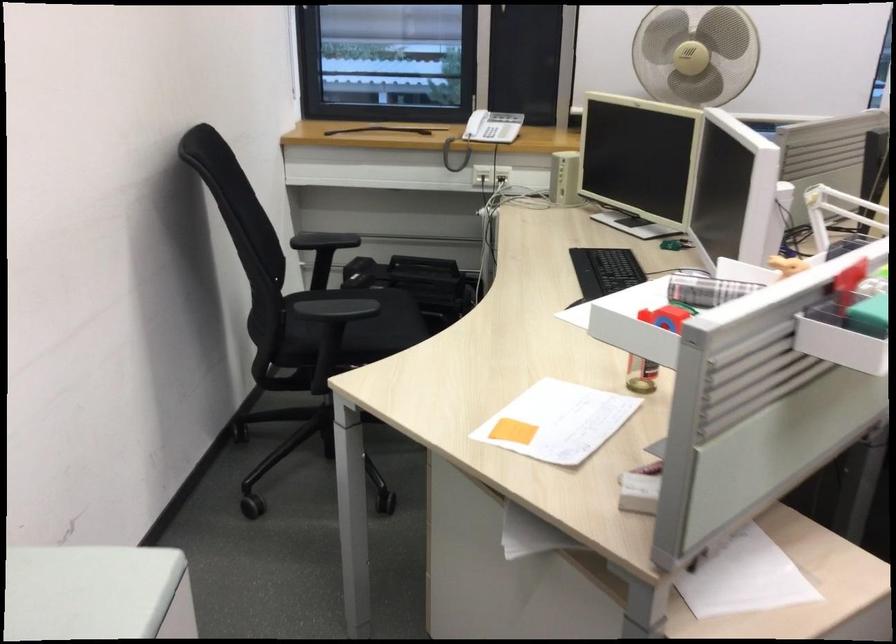
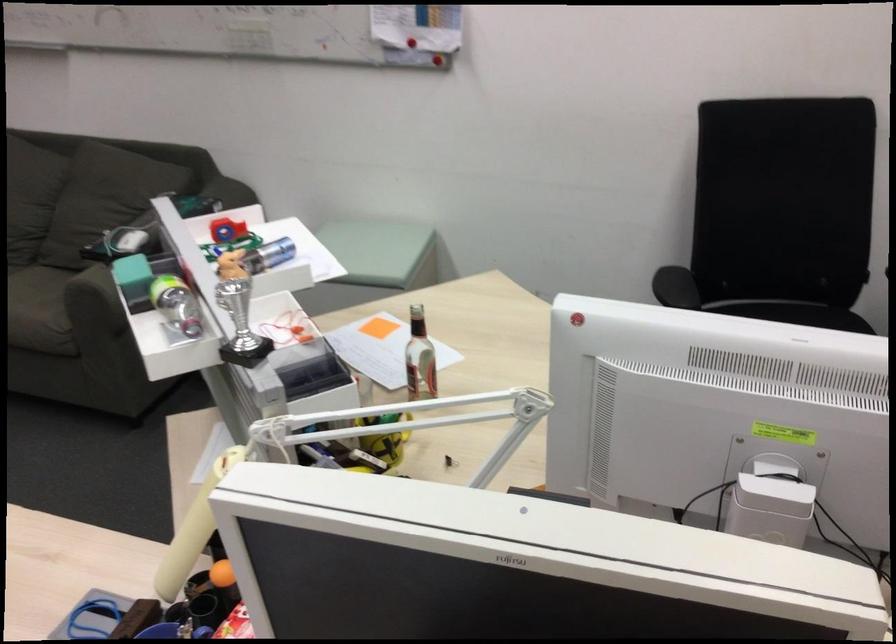
Locate, in the second image, the point that corresponds to point (341, 308) in the first image.

(675, 287)